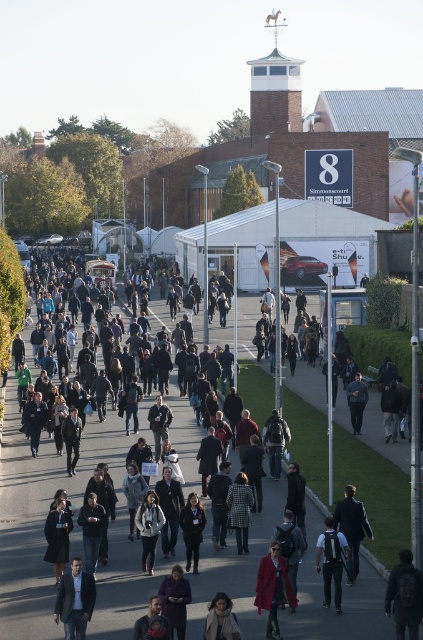
The image size is (423, 640). Describe the element at coordinates (351, 529) in the screenshot. I see `dark gray coat at center` at that location.

Between dark gray coat at center and dark gray coat at lower left, which one is positioned higher?

dark gray coat at center is above.

The image size is (423, 640). What do you see at coordinates (351, 529) in the screenshot?
I see `dark gray coat at center` at bounding box center [351, 529].

In order to click on dark gray coat at center in this screenshot , I will do `click(351, 529)`.

Which is more to the left, dark gray backpack at lower right or dark blue coat at center?

Positioned to the left is dark blue coat at center.

Can you confirm if dark gray backpack at lower right is positioned to the left of dark blue coat at center?

Incorrect, dark gray backpack at lower right is not on the left side of dark blue coat at center.

Find the location of a particular element. dark gray backpack at lower right is located at coordinates (404, 596).

Which is more to the left, dark gray coat at lower left or light brown leather jacket at lower center?

dark gray coat at lower left is more to the left.

Between dark gray coat at lower left and light brown leather jacket at lower center, which one has more height?

dark gray coat at lower left is taller.

This screenshot has height=640, width=423. I want to click on dark gray coat at lower left, so click(x=57, y=538).